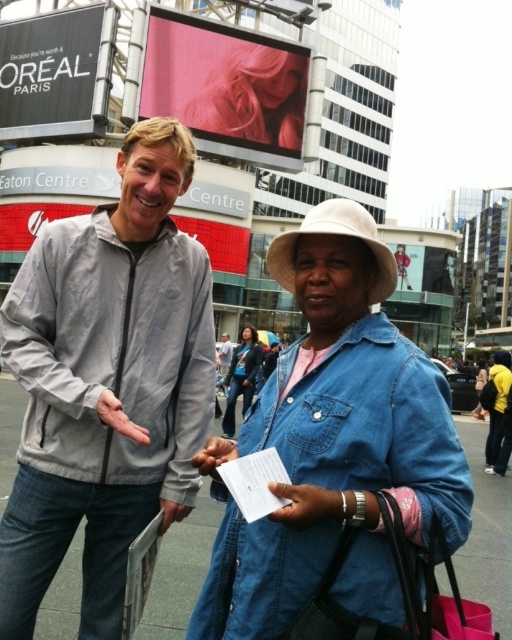
From the picture: You are a photographer trying to capture a clear shot of both the denim jacket at lower right and the denim jacket at center. However, you notice that one is blocking the other. Which denim jacket is covering the other one?

The denim jacket at lower right is positioned over denim jacket at center, so it is covering the denim jacket at center.

You are a photographer standing in the public square and want to take a photo of both the denim jacket at lower right and the denim jacket at center. However, you notice that one of them is blocking the view of the other. Which denim jacket is in front and might be obscuring the other?

The denim jacket at lower right is in front of the denim jacket at center, so it might be obscuring the view of the denim jacket at center.